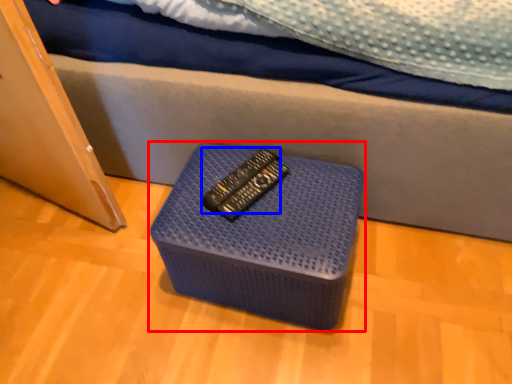
Question: Which object is closer to the camera taking this photo, furniture (highlighted by a red box) or remote (highlighted by a blue box)?

Choices:
 (A) furniture
 (B) remote

Answer: (A)